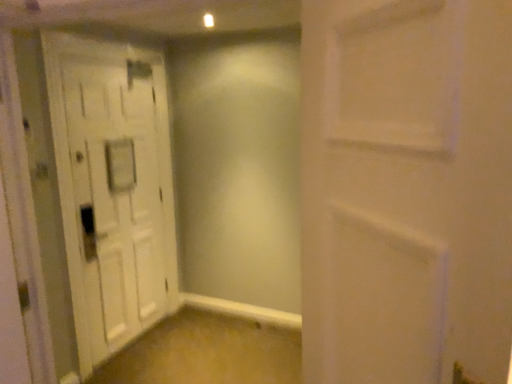
Based on the photo, measure the distance between point (97, 299) and camera.

Point (97, 299) is 9.19 feet from camera.

The height and width of the screenshot is (384, 512). Identify the location of white wooden door at left, the 2th door positioned from the right. (113, 187).

What is the approximate height of white wooden door at left, which appears as the second door when viewed from the front?

6.75 feet.

What do you see at coordinates (113, 187) in the screenshot? I see `white wooden door at left, which appears as the second door when viewed from the front` at bounding box center [113, 187].

What do you see at coordinates (406, 189) in the screenshot? I see `white matte door at center, which ranks as the 1th door in right-to-left order` at bounding box center [406, 189].

I want to click on white matte door at center, which ranks as the 1th door in right-to-left order, so click(406, 189).

You are a GUI agent. You are given a task and a screenshot of the screen. Output one action in this format:
    pyautogui.click(x=<x>, y=<y>)
    Task: Click on the white wooden door at left, the 2th door positioned from the right
    Image resolution: width=512 pixels, height=384 pixels.
    Given the screenshot: What is the action you would take?
    pyautogui.click(x=113, y=187)

Considering the relative positions of white wooden door at left, the 2th door positioned from the right, and white matte door at center, which ranks as the 1th door in right-to-left order, in the image provided, is white wooden door at left, the 2th door positioned from the right, to the right of white matte door at center, which ranks as the 1th door in right-to-left order, from the viewer's perspective?

In fact, white wooden door at left, the 2th door positioned from the right, is to the left of white matte door at center, which ranks as the 1th door in right-to-left order.

Which object is more forward, white wooden door at left, placed as the first door when sorted from back to front, or white matte door at center, the second door from the back?

white matte door at center, the second door from the back.

Which point is more distant from viewer, (68, 138) or (420, 203)?

The point (68, 138) is more distant.

From the image's perspective, is white wooden door at left, the first door in the left-to-right sequence, positioned above or below white matte door at center, which ranks as the 1th door in right-to-left order?

Based on their image positions, white wooden door at left, the first door in the left-to-right sequence, is located above white matte door at center, which ranks as the 1th door in right-to-left order.

From a real-world perspective, is white wooden door at left, the first door in the left-to-right sequence, over white matte door at center, acting as the second door starting from the left?

Incorrect, from a real-world perspective, white wooden door at left, the first door in the left-to-right sequence, is lower than white matte door at center, acting as the second door starting from the left.

Considering the relative sizes of white wooden door at left, the 2th door positioned from the right, and white matte door at center, acting as the second door starting from the left, in the image provided, is white wooden door at left, the 2th door positioned from the right, wider than white matte door at center, acting as the second door starting from the left,?

Yes, white wooden door at left, the 2th door positioned from the right, is wider than white matte door at center, acting as the second door starting from the left.

From their relative heights in the image, would you say white wooden door at left, the 2th door positioned from the right, is taller or shorter than white matte door at center, the second door from the back?

Clearly, white wooden door at left, the 2th door positioned from the right, is taller compared to white matte door at center, the second door from the back.

Does white wooden door at left, which appears as the second door when viewed from the front, have a smaller size compared to white matte door at center, which is the first door from front to back?

No.

Is white wooden door at left, the first door in the left-to-right sequence, not inside white matte door at center, which ranks as the 1th door in right-to-left order?

Yes, white wooden door at left, the first door in the left-to-right sequence, is located beyond the bounds of white matte door at center, which ranks as the 1th door in right-to-left order.

Is white wooden door at left, placed as the first door when sorted from back to front, touching white matte door at center, which is the first door from front to back?

No, white wooden door at left, placed as the first door when sorted from back to front, is not making contact with white matte door at center, which is the first door from front to back.

Is white wooden door at left, placed as the first door when sorted from back to front, oriented away from white matte door at center, which is the first door from front to back?

No, white wooden door at left, placed as the first door when sorted from back to front,'s orientation is not away from white matte door at center, which is the first door from front to back.

Where is `door that appears above the white matte door at center, the second door from the back (from the image's perspective)`? door that appears above the white matte door at center, the second door from the back (from the image's perspective) is located at coordinates (113, 187).

Which object is positioned more to the right, white matte door at center, the second door from the back, or white wooden door at left, placed as the first door when sorted from back to front?

From the viewer's perspective, white matte door at center, the second door from the back, appears more on the right side.

Is white matte door at center, which ranks as the 1th door in right-to-left order, in front of or behind white wooden door at left, placed as the first door when sorted from back to front, in the image?

Visually, white matte door at center, which ranks as the 1th door in right-to-left order, is located in front of white wooden door at left, placed as the first door when sorted from back to front.

Which is behind, point (481, 257) or point (96, 96)?

Positioned behind is point (96, 96).

From the image's perspective, which object appears higher, white matte door at center, acting as the second door starting from the left, or white wooden door at left, the first door in the left-to-right sequence?

white wooden door at left, the first door in the left-to-right sequence, is shown above in the image.

From a real-world perspective, relative to white wooden door at left, which appears as the second door when viewed from the front, is white matte door at center, which ranks as the 1th door in right-to-left order, vertically above or below?

white matte door at center, which ranks as the 1th door in right-to-left order, is situated higher than white wooden door at left, which appears as the second door when viewed from the front, in the real world.

In terms of width, does white matte door at center, acting as the second door starting from the left, look wider or thinner when compared to white wooden door at left, which appears as the second door when viewed from the front?

Clearly, white matte door at center, acting as the second door starting from the left, has less width compared to white wooden door at left, which appears as the second door when viewed from the front.

Considering the sizes of objects white matte door at center, which ranks as the 1th door in right-to-left order, and white wooden door at left, the 2th door positioned from the right, in the image provided, who is taller, white matte door at center, which ranks as the 1th door in right-to-left order, or white wooden door at left, the 2th door positioned from the right,?

Standing taller between the two is white wooden door at left, the 2th door positioned from the right.

Can you confirm if white matte door at center, acting as the second door starting from the left, is bigger than white wooden door at left, placed as the first door when sorted from back to front?

Incorrect, white matte door at center, acting as the second door starting from the left, is not larger than white wooden door at left, placed as the first door when sorted from back to front.

Is white matte door at center, which is the first door from front to back, situated inside white wooden door at left, the first door in the left-to-right sequence, or outside?

The correct answer is: outside.

Consider the image. Is white matte door at center, which ranks as the 1th door in right-to-left order, with white wooden door at left, the 2th door positioned from the right?

No, white matte door at center, which ranks as the 1th door in right-to-left order, is not beside white wooden door at left, the 2th door positioned from the right.

Could you tell me if white matte door at center, the second door from the back, is turned towards white wooden door at left, the 2th door positioned from the right?

No, white matte door at center, the second door from the back, is not turned towards white wooden door at left, the 2th door positioned from the right.

This screenshot has height=384, width=512. Find the location of `door behind the white matte door at center, which is the first door from front to back`. door behind the white matte door at center, which is the first door from front to back is located at coordinates (113, 187).

You are a GUI agent. You are given a task and a screenshot of the screen. Output one action in this format:
    pyautogui.click(x=<x>, y=<y>)
    Task: Click on the door below the white matte door at center, which is the first door from front to back (from a real-world perspective)
    
    Given the screenshot: What is the action you would take?
    pyautogui.click(x=113, y=187)

I want to click on door above the white wooden door at left, placed as the first door when sorted from back to front (from a real-world perspective), so click(406, 189).